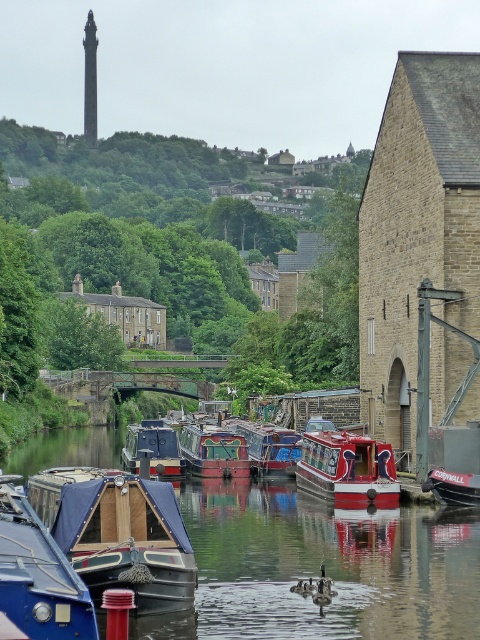
You are standing on the dock and see the blue canvas boat at lower left and the matte blue boat at center. Which boat is closer to the water surface?

The matte blue boat at center is closer to the water surface because the blue canvas boat at lower left is located above it.

You are standing at the origin point of the coordinate system in this canal scene. You want to move towards the wooden polished boat at center. What are the coordinates you need to navigate to reach it?

The wooden polished boat at center is located at coordinates point (214, 451), so you need to navigate to those coordinates to reach it.

You are standing on the dock and looking at the wooden polished boat at center and the red polished wood boat at center. Which boat is closer to the water surface?

The wooden polished boat at center is closer to the water surface because it is positioned below the red polished wood boat at center.